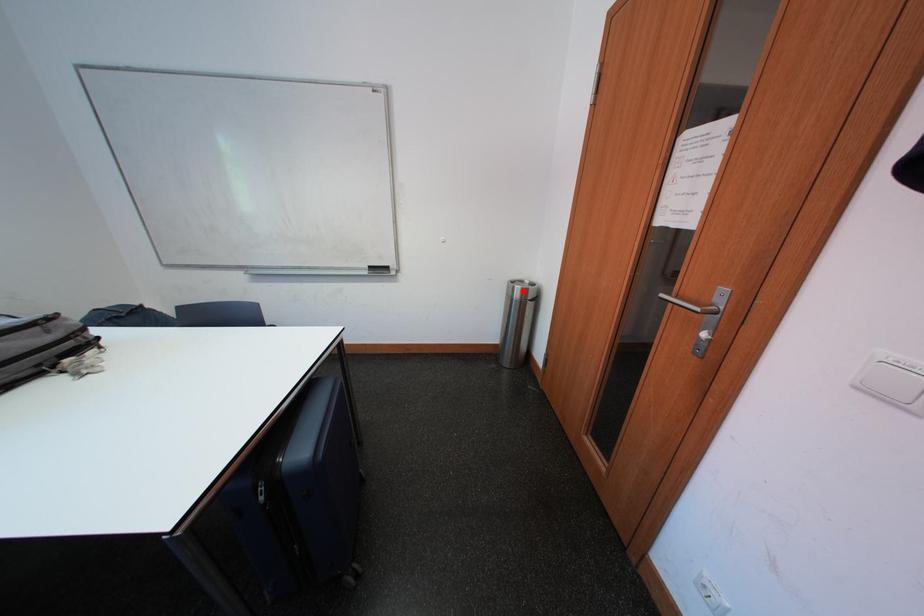
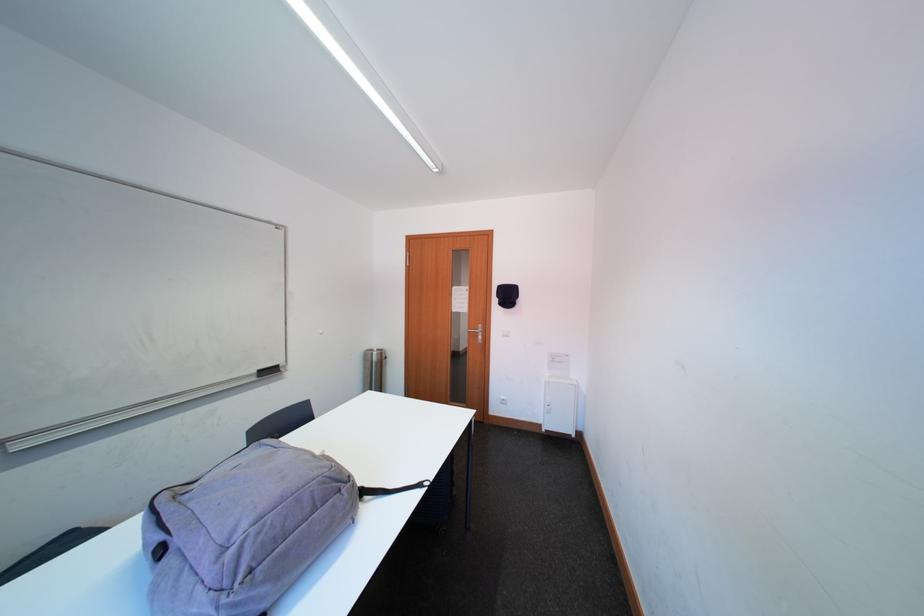
Question: I am providing you with two images of the same scene from different viewpoints. Given a red point in image1, look at the same physical point in image2. Is it:

Choices:
 (A) Closer to the viewpoint
 (B) Farther from the viewpoint

Answer: (B)